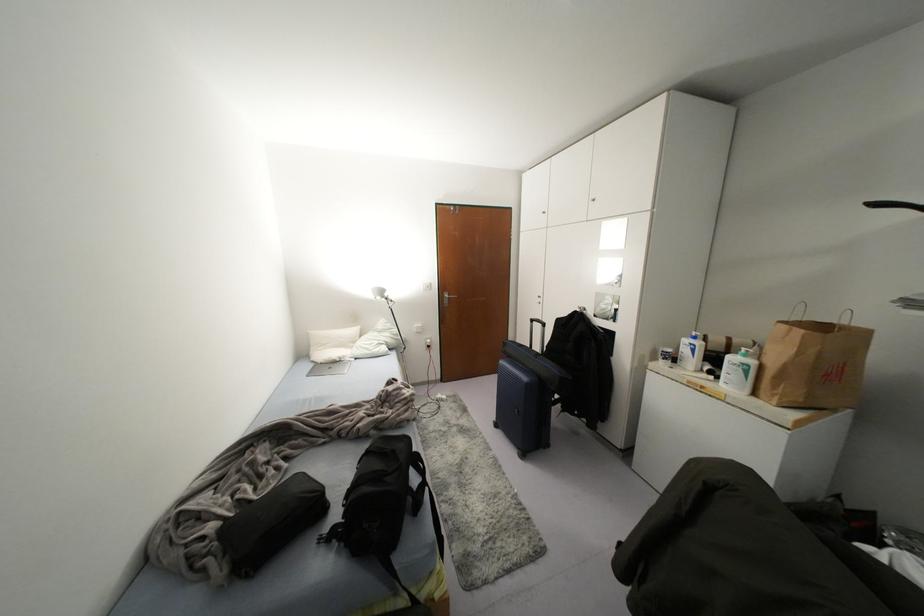
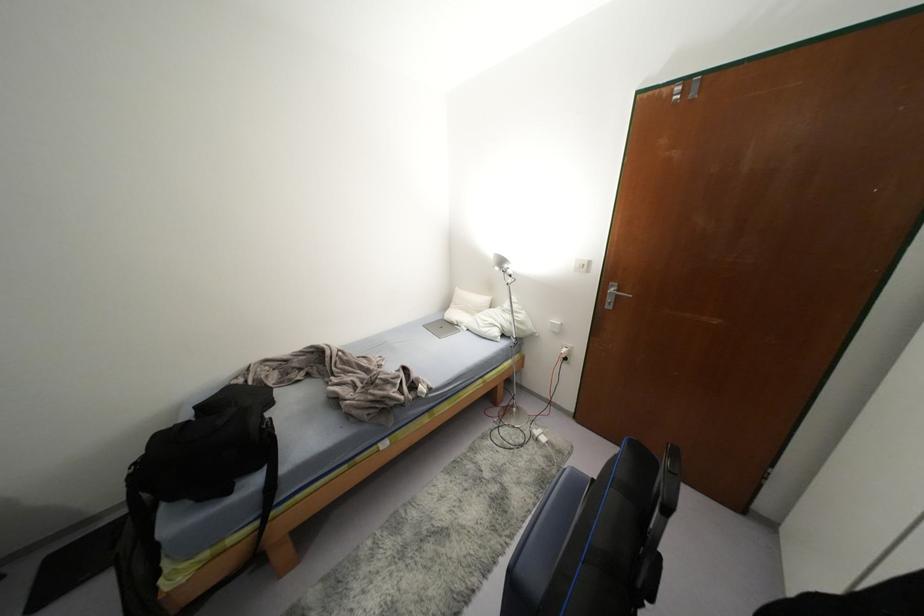
Locate, in the second image, the point that corresponds to point 445,296 in the first image.

(612, 289)